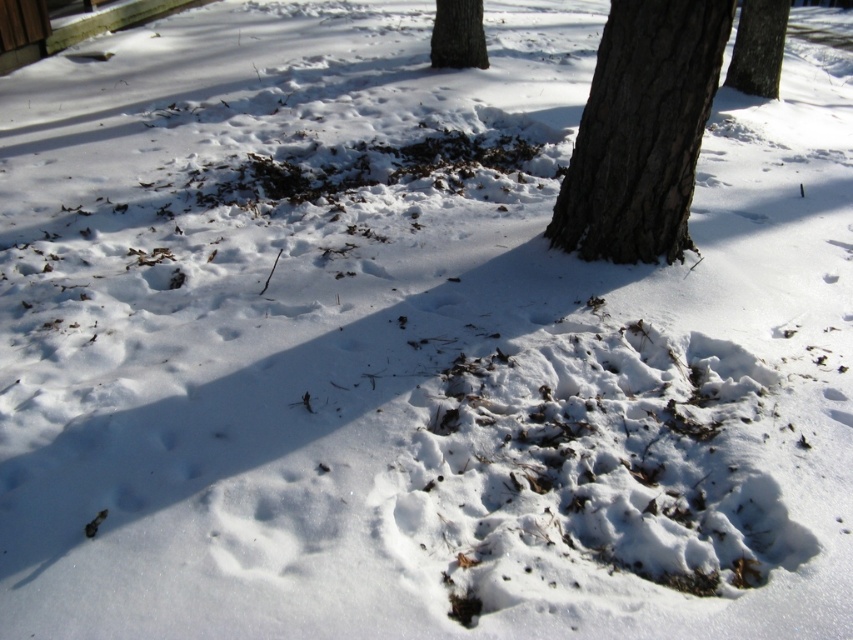
Is brown rough bark tree at center closer to camera compared to brown rough bark tree at upper center?

No, brown rough bark tree at center is behind brown rough bark tree at upper center.

Does point (743, 76) come in front of point (463, 8)?

That is False.

Find the location of a particular element. The image size is (853, 640). brown rough bark tree at center is located at coordinates (758, 48).

Who is higher up, dark brown bark tree at center or brown rough bark tree at upper center?

brown rough bark tree at upper center

Does dark brown bark tree at center appear under brown rough bark tree at upper center?

Yes, dark brown bark tree at center is below brown rough bark tree at upper center.

I want to click on dark brown bark tree at center, so click(641, 131).

Does point (601, 163) come farther from viewer compared to point (773, 60)?

No, (601, 163) is in front of (773, 60).

How far apart are dark brown bark tree at center and brown rough bark tree at center?

dark brown bark tree at center is 4.38 meters from brown rough bark tree at center.

Is point (631, 74) positioned before point (740, 74)?

That is True.

The height and width of the screenshot is (640, 853). Identify the location of dark brown bark tree at center. (641, 131).